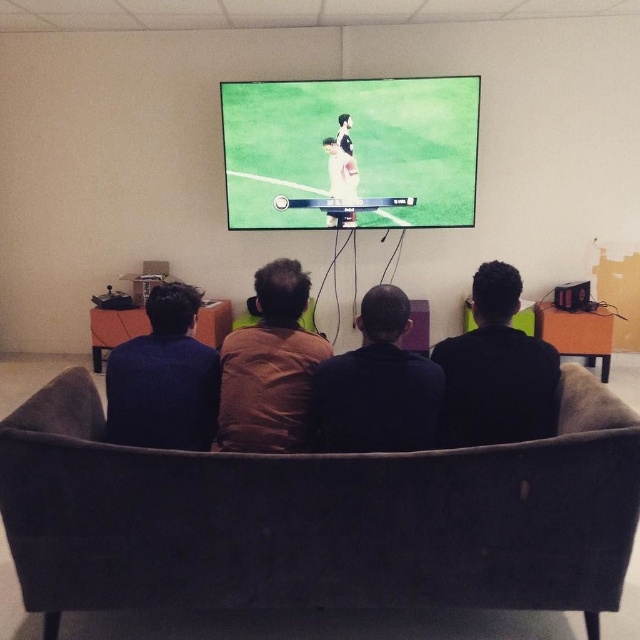
Can you confirm if green matte screen at upper center is positioned to the left of dark blue sweater at left?

In fact, green matte screen at upper center is to the right of dark blue sweater at left.

Identify the location of green matte screen at upper center. The image size is (640, 640). (349, 152).

Does point (348, 116) come in front of point (129, 356)?

No, it is behind (129, 356).

Find the location of `green matte screen at upper center`. green matte screen at upper center is located at coordinates (349, 152).

Does black matte shirt at center appear under white fabric shirt at center?

Indeed, black matte shirt at center is positioned under white fabric shirt at center.

Is point (484, 401) more distant than point (339, 177)?

No, (484, 401) is closer to viewer.

Where is `black matte shirt at center`? This screenshot has height=640, width=640. black matte shirt at center is located at coordinates (497, 369).

The height and width of the screenshot is (640, 640). I want to click on black matte shirt at center, so click(x=497, y=369).

Between black matte shirt at center and brown fabric shirt at center, which one has less height?

black matte shirt at center

Describe the element at coordinates (497, 369) in the screenshot. I see `black matte shirt at center` at that location.

I want to click on black matte shirt at center, so click(x=497, y=369).